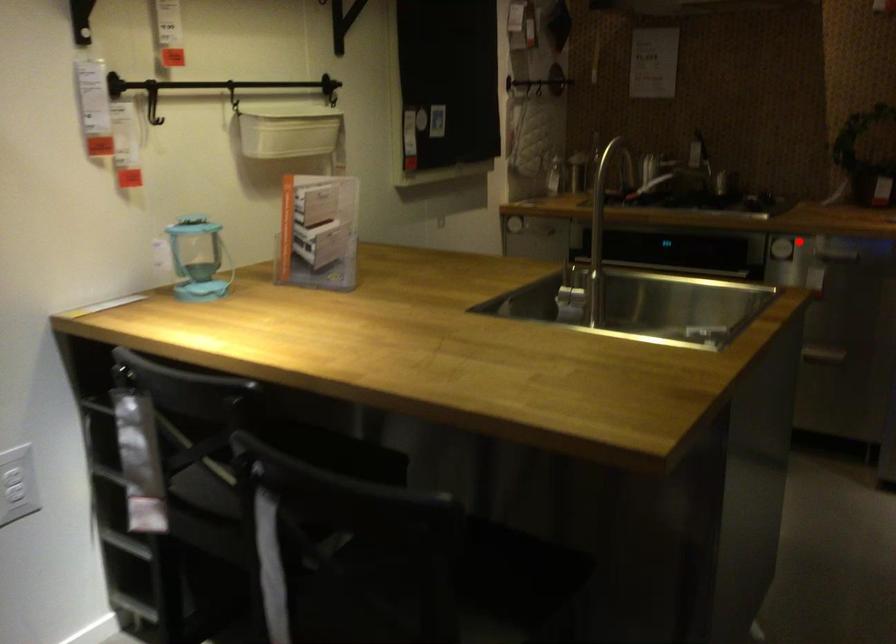
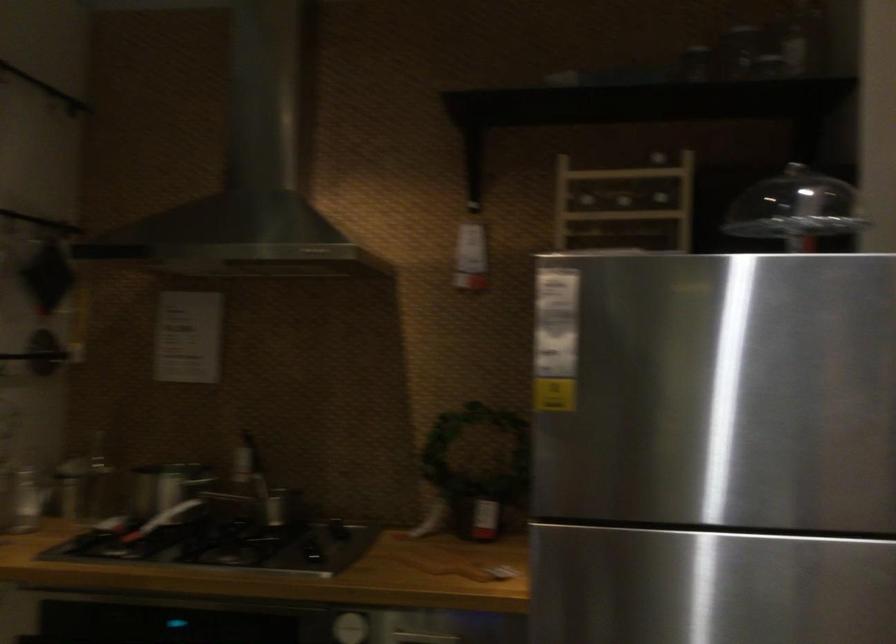
Question: I am providing you with two images of the same scene from different viewpoints. In image1, a red point is highlighted. Considering the same 3D point in image2, which of the following is correct?

Choices:
 (A) It is closer
 (B) It is farther

Answer: (A)